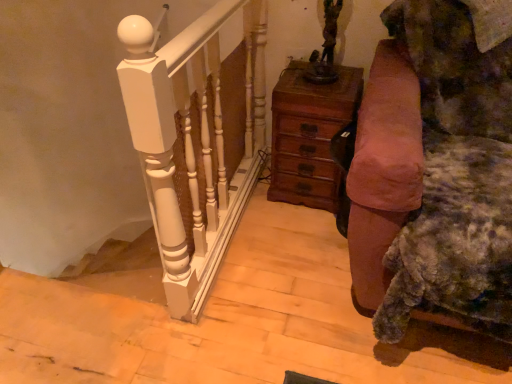
Question: In terms of height, does wooden chest of drawers at center look taller or shorter compared to velvet brown couch at right?

Choices:
 (A) tall
 (B) short

Answer: (B)

Question: From a real-world perspective, is wooden chest of drawers at center physically located above or below velvet brown couch at right?

Choices:
 (A) above
 (B) below

Answer: (B)

Question: Is point (333, 173) positioned closer to the camera than point (389, 147)?

Choices:
 (A) farther
 (B) closer

Answer: (A)

Question: From a real-world perspective, is velvet brown couch at right above or below wooden chest of drawers at center?

Choices:
 (A) below
 (B) above

Answer: (B)

Question: From the image's perspective, is velvet brown couch at right positioned above or below wooden chest of drawers at center?

Choices:
 (A) below
 (B) above

Answer: (A)

Question: Is point (505, 296) positioned closer to the camera than point (323, 168)?

Choices:
 (A) farther
 (B) closer

Answer: (B)

Question: Would you say velvet brown couch at right is to the left or to the right of wooden chest of drawers at center in the picture?

Choices:
 (A) left
 (B) right

Answer: (B)